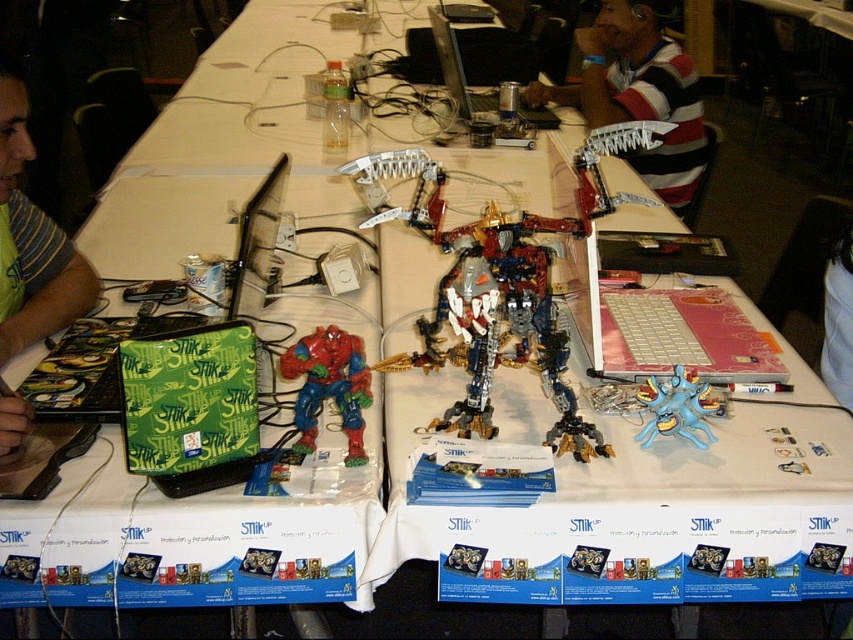
You are a photographer at the event and need to capture a photo of the metallic silver laptop at center without the striped shirt at upper right appearing in the frame. Can you adjust your position to the left side of the table to achieve this?

The striped shirt at upper right is positioned on the right side of the metallic silver laptop at center. By moving to the left side of the table, you can position yourself so that the striped shirt at upper right is out of the frame while keeping the metallic silver laptop at center centered in the shot.